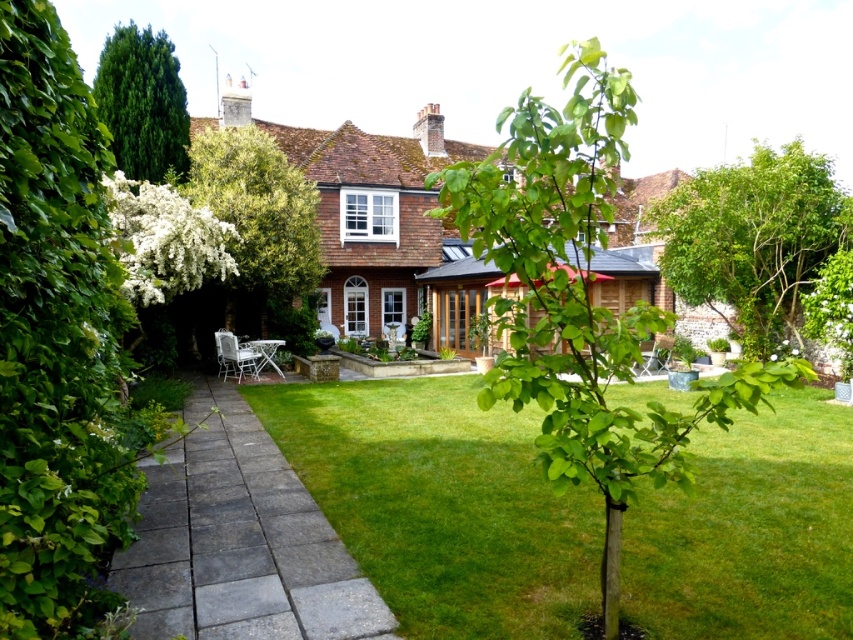
Which is behind, point (712, 460) or point (247, 484)?

The point (712, 460) is behind.

Is green grass at center taller than gray stone path at center?

Yes.

Where is `green grass at center`? green grass at center is located at coordinates 442,502.

Can you confirm if green leafy tree at center is wider than green leafy tree at upper left?

Correct, the width of green leafy tree at center exceeds that of green leafy tree at upper left.

Image resolution: width=853 pixels, height=640 pixels. What do you see at coordinates (579, 300) in the screenshot? I see `green leafy tree at center` at bounding box center [579, 300].

Where is `green leafy tree at center`? green leafy tree at center is located at coordinates (579, 300).

The image size is (853, 640). I want to click on green leafy tree at center, so click(579, 300).

Image resolution: width=853 pixels, height=640 pixels. What do you see at coordinates (442, 502) in the screenshot?
I see `green grass at center` at bounding box center [442, 502].

Does point (631, 598) come farther from viewer compared to point (57, 108)?

Yes, it is.

Image resolution: width=853 pixels, height=640 pixels. Identify the location of green grass at center. (442, 502).